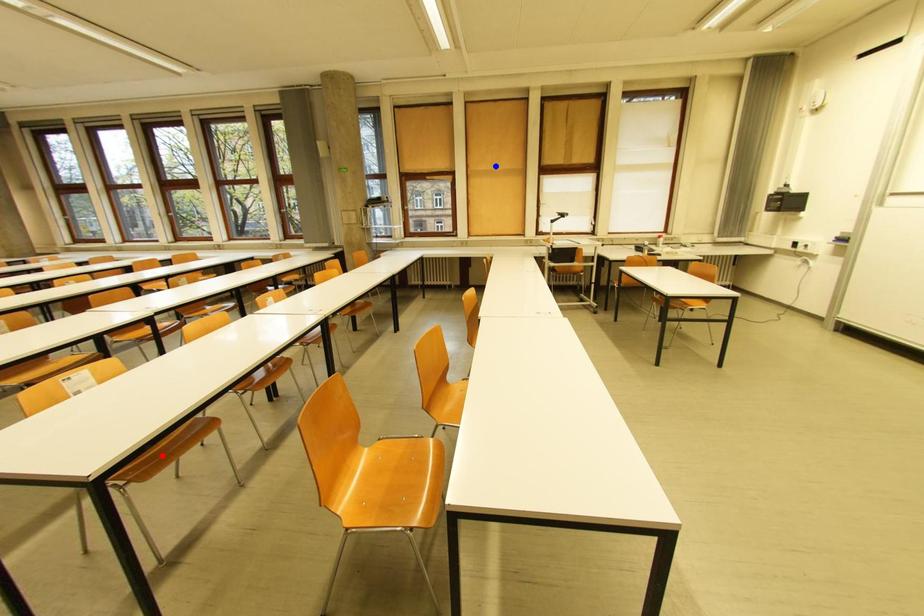
Question: Two points are marked on the image. Which point is closer to the camera?

Choices:
 (A) Blue point is closer.
 (B) Red point is closer.

Answer: (B)